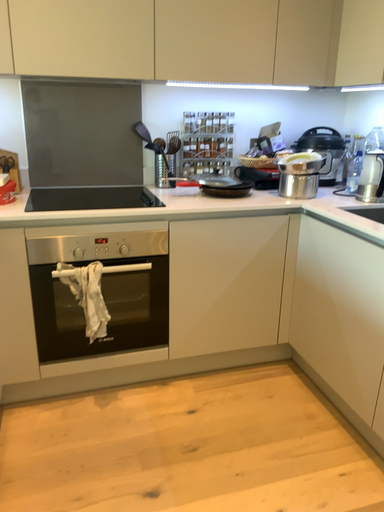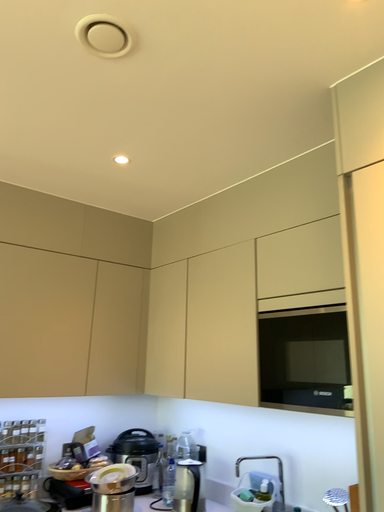
Question: Which way did the camera rotate in the video?

Choices:
 (A) rotated left
 (B) rotated right

Answer: (B)